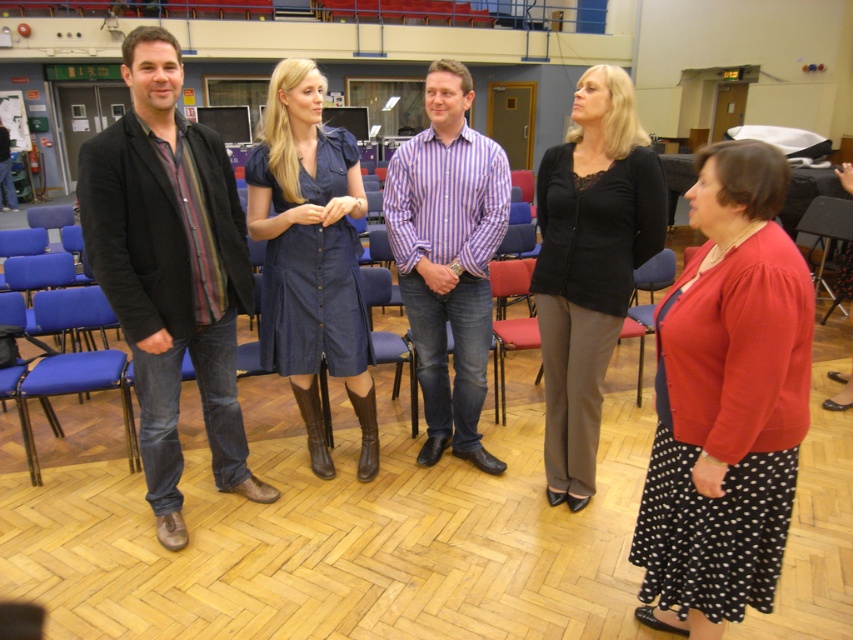
Question: Which of the following is the farthest from the observer?

Choices:
 (A) (264, 348)
 (B) (440, 284)
 (C) (79, 316)

Answer: (C)

Question: Among these points, which one is nearest to the camera?

Choices:
 (A) (212, 429)
 (B) (468, 244)

Answer: (B)

Question: Where is matte black blazer at left located in relation to blue fabric chair at left in the image?

Choices:
 (A) below
 (B) above

Answer: (B)

Question: Does denim dress at center appear under blue fabric chair at left?

Choices:
 (A) yes
 (B) no

Answer: (B)

Question: Considering the relative positions of matte black blazer at left and blue fabric chair at left in the image provided, where is matte black blazer at left located with respect to blue fabric chair at left?

Choices:
 (A) left
 (B) right

Answer: (B)

Question: Among these objects, which one is farthest from the camera?

Choices:
 (A) striped cotton shirt at center
 (B) black dotted skirt at lower right
 (C) denim dress at center

Answer: (A)